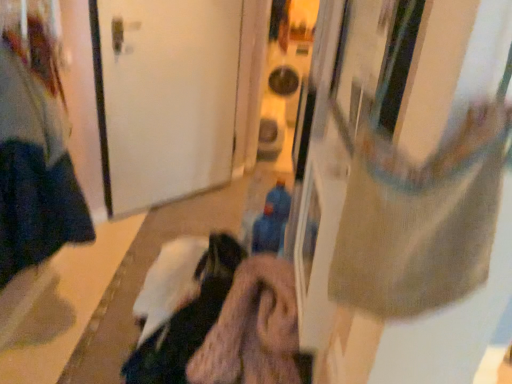
Question: Considering the positions of blue fabric toy at center and dark blue fabric at left in the image, is blue fabric toy at center bigger or smaller than dark blue fabric at left?

Choices:
 (A) big
 (B) small

Answer: (B)

Question: From the image's perspective, relative to dark blue fabric at left, is blue fabric toy at center above or below?

Choices:
 (A) below
 (B) above

Answer: (A)

Question: Based on their relative distances, which object is nearer to the white matte door at center?

Choices:
 (A) dark blue fabric at left
 (B) blue fabric toy at center

Answer: (A)

Question: Estimate the real-world distances between objects in this image. Which object is closer to the dark blue fabric at left?

Choices:
 (A) blue fabric toy at center
 (B) white matte door at center

Answer: (B)